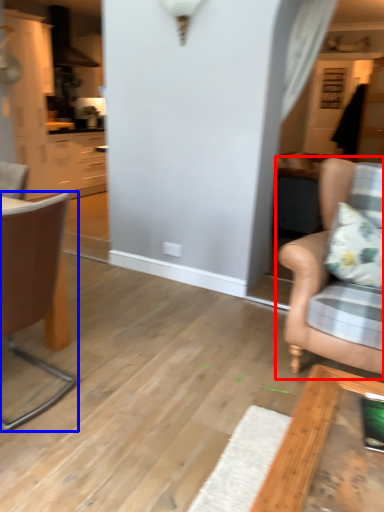
Question: Which object appears farthest to the camera in this image, chair (highlighted by a red box) or chair (highlighted by a blue box)?

Choices:
 (A) chair
 (B) chair

Answer: (A)